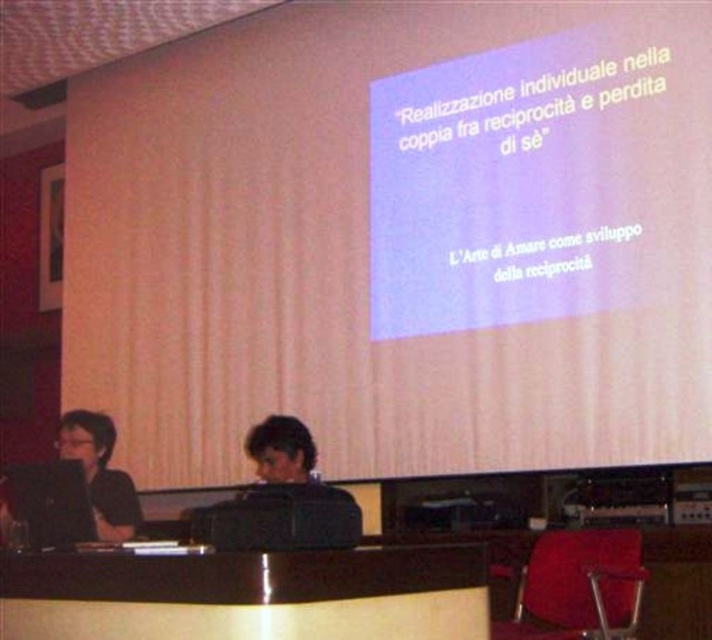
You are a guest speaker who needs to move from the velvet red chair at lower right to the black glossy table at center to present your slides. Which direction should you move to reach the table?

The black glossy table at center is positioned on the left side of the velvet red chair at lower right, so you should move to your left to reach the table.

You are a photographer setting up for a presentation. You need to place a 0.5 meters wide projector on the black glossy table at center. The table has a coordinate system where the bottom left corner is the origin. The point at coordinate (x=248, y=595) is on the table. Can you place the projector so that it doesn,t obstruct the presenter who is standing at the front of the table? Please answer yes or no and explain.

The point at coordinate (x=248, y=595) marks the black glossy table at center. Since the projector is 0.5 meters wide and the table has enough space around the marked point, you can place the projector without obstructing the presenter at the front.

You are a guest speaker at a conference. You need to move from your current position to the podium at the front of the room. There is a black glossy table at center and a velvet red chair at lower right in your way. Which object should you move around to reach the podium?

You should move around the velvet red chair at lower right because the black glossy table at center is located above it, meaning the table is closer to the front and the chair is behind it. To reach the podium at the front, you would need to go around the chair which is behind the table.